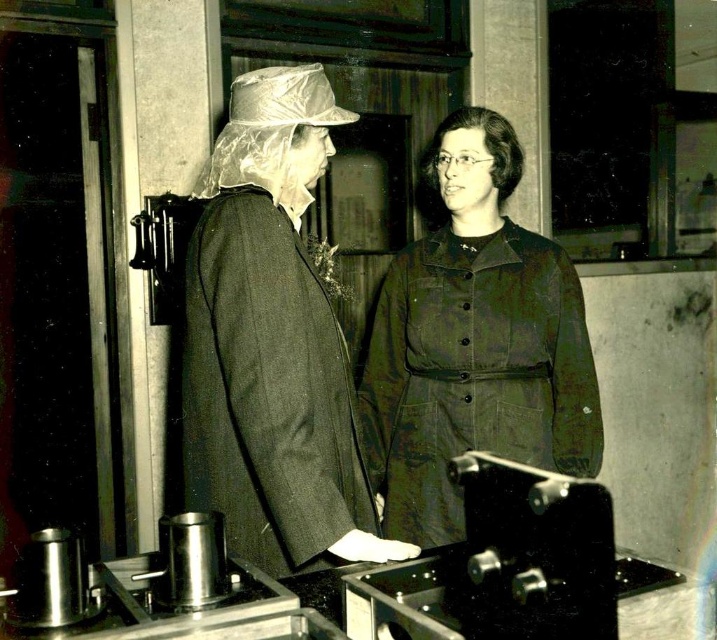
You are an observer standing in front of the two coats displayed in the laboratory setting. Which coat, the matte black coat at center or the olive green fabric coat at center, has a shorter length?

The matte black coat at center is shorter than the olive green fabric coat at center.

You are an observer in the laboratory scene. You see the matte black coat at center and the olive green fabric coat at center. Which coat is located to the left?

The matte black coat at center is positioned on the left side of the olive green fabric coat at center, so it is located to the left.